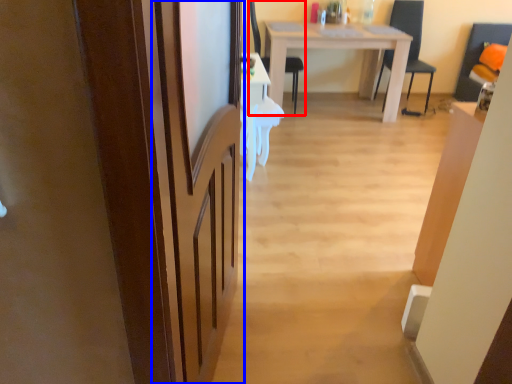
Question: Which object is further to the camera taking this photo, chair (highlighted by a red box) or screen door (highlighted by a blue box)?

Choices:
 (A) chair
 (B) screen door

Answer: (A)